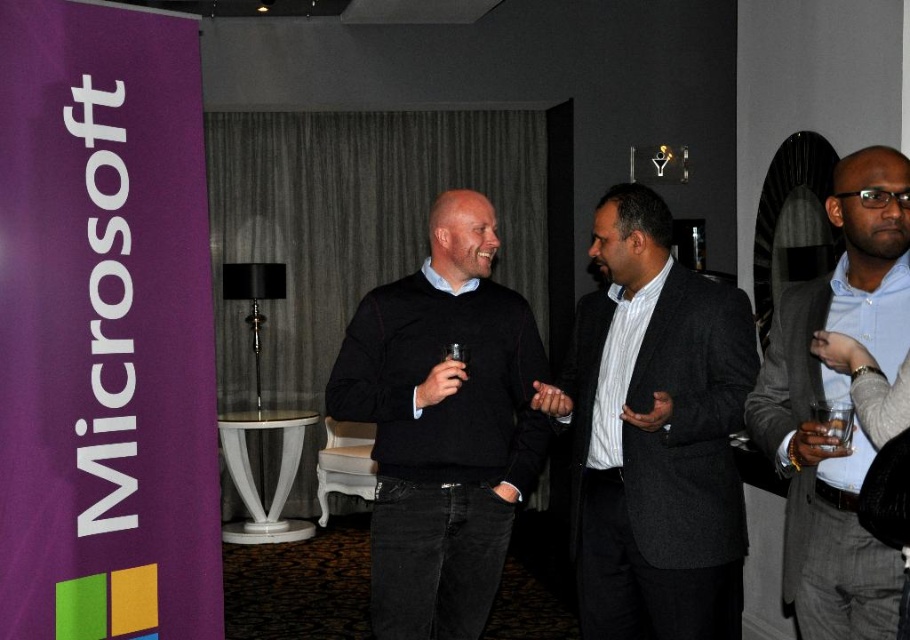
Question: Can you confirm if dark gray suit at center is positioned below black sweater at center?

Choices:
 (A) yes
 (B) no

Answer: (A)

Question: Is dark gray suit at center smaller than light blue shirt at right?

Choices:
 (A) no
 (B) yes

Answer: (A)

Question: Does dark gray suit at center lie in front of light blue shirt at right?

Choices:
 (A) no
 (B) yes

Answer: (A)

Question: Among these objects, which one is farthest from the camera?

Choices:
 (A) dark gray suit at center
 (B) black sweater at center
 (C) light blue shirt at right

Answer: (B)

Question: Among these objects, which one is nearest to the camera?

Choices:
 (A) black sweater at center
 (B) light blue shirt at right
 (C) dark gray suit at center

Answer: (B)

Question: Among these points, which one is farthest from the camera?

Choices:
 (A) (615, 243)
 (B) (812, 324)

Answer: (A)